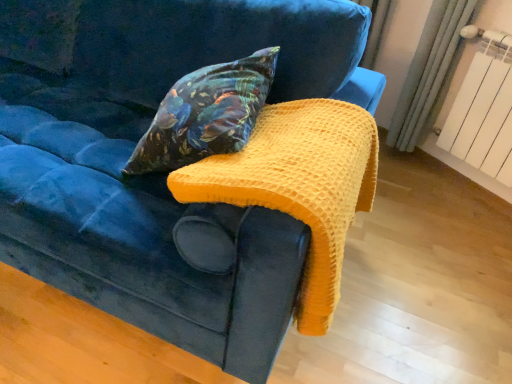
In the scene shown: Measure the distance between velvet floral pillow at center and camera.

velvet floral pillow at center and camera are 38.06 inches apart from each other.

Locate an element on the screen. The height and width of the screenshot is (384, 512). white painted metal radiator at upper right is located at coordinates (482, 105).

The width and height of the screenshot is (512, 384). I want to click on yellow waffle knit blanket at upper center, so click(x=298, y=185).

This screenshot has width=512, height=384. Find the location of `velvet floral pillow at center`. velvet floral pillow at center is located at coordinates (206, 114).

Does yellow waffle knit blanket at upper center have a lesser width compared to white painted metal radiator at upper right?

Incorrect, the width of yellow waffle knit blanket at upper center is not less than that of white painted metal radiator at upper right.

Based on the photo, which is closer to the camera, (x=312, y=220) or (x=498, y=101)?

Point (x=312, y=220) is positioned closer to the camera compared to point (x=498, y=101).

Find the location of a particular element. The height and width of the screenshot is (384, 512). blanket below the white painted metal radiator at upper right (from the image's perspective) is located at coordinates (298, 185).

Considering the relative sizes of yellow waffle knit blanket at upper center and white painted metal radiator at upper right in the image provided, is yellow waffle knit blanket at upper center bigger than white painted metal radiator at upper right?

Yes.

Find the location of a particular element. This screenshot has width=512, height=384. pillow to the left of yellow waffle knit blanket at upper center is located at coordinates (206, 114).

Could you tell me if velvet floral pillow at center is turned towards yellow waffle knit blanket at upper center?

No.

Is point (145, 137) closer or farther from the camera than point (327, 205)?

Clearly, point (145, 137) is more distant from the camera than point (327, 205).

Considering their positions, is velvet floral pillow at center located in front of or behind yellow waffle knit blanket at upper center?

velvet floral pillow at center is positioned farther from the viewer than yellow waffle knit blanket at upper center.

Is white painted metal radiator at upper right next to yellow waffle knit blanket at upper center?

No.

You are a GUI agent. You are given a task and a screenshot of the screen. Output one action in this format:
    pyautogui.click(x=<x>, y=<y>)
    Task: Click on the blanket in front of the white painted metal radiator at upper right
    
    Given the screenshot: What is the action you would take?
    pyautogui.click(x=298, y=185)

Can yellow waffle knit blanket at upper center be found inside white painted metal radiator at upper right?

No, yellow waffle knit blanket at upper center is not surrounded by white painted metal radiator at upper right.

From the image's perspective, is white painted metal radiator at upper right below yellow waffle knit blanket at upper center?

Incorrect, from the image's perspective, white painted metal radiator at upper right is higher than yellow waffle knit blanket at upper center.

Is velvet floral pillow at center aimed at white painted metal radiator at upper right?

No, velvet floral pillow at center is not aimed at white painted metal radiator at upper right.

Is point (198, 132) positioned before point (498, 91)?

Yes, point (198, 132) is closer to viewer.

This screenshot has width=512, height=384. What are the coordinates of `radiator on the right of velvet floral pillow at center` in the screenshot? It's located at (482, 105).

Based on the photo, is velvet floral pillow at center shorter than white painted metal radiator at upper right?

Indeed, velvet floral pillow at center has a lesser height compared to white painted metal radiator at upper right.

From the image's perspective, between white painted metal radiator at upper right and velvet floral pillow at center, who is located below?

velvet floral pillow at center, from the image's perspective.

Does white painted metal radiator at upper right turn towards velvet floral pillow at center?

Yes, white painted metal radiator at upper right faces towards velvet floral pillow at center.

How distant is white painted metal radiator at upper right from velvet floral pillow at center?

white painted metal radiator at upper right and velvet floral pillow at center are 4.39 feet apart from each other.

Looking at their sizes, would you say white painted metal radiator at upper right is wider or thinner than velvet floral pillow at center?

Considering their sizes, white painted metal radiator at upper right looks slimmer than velvet floral pillow at center.

Is yellow waffle knit blanket at upper center not close to velvet floral pillow at center?

yellow waffle knit blanket at upper center is near velvet floral pillow at center, not far away.

Considering the sizes of objects yellow waffle knit blanket at upper center and velvet floral pillow at center in the image provided, who is thinner, yellow waffle knit blanket at upper center or velvet floral pillow at center?

velvet floral pillow at center.

Locate an element on the screen. The image size is (512, 384). blanket in front of the velvet floral pillow at center is located at coordinates (298, 185).

Find the location of a particular element. blanket on the left side of white painted metal radiator at upper right is located at coordinates (298, 185).

This screenshot has width=512, height=384. In order to click on blanket to the right of velvet floral pillow at center in this screenshot , I will do `click(298, 185)`.

Based on their spatial positions, is yellow waffle knit blanket at upper center or white painted metal radiator at upper right further from velvet floral pillow at center?

white painted metal radiator at upper right is positioned further to the anchor velvet floral pillow at center.

Looking at the image, which one is located closer to yellow waffle knit blanket at upper center, velvet floral pillow at center or white painted metal radiator at upper right?

Among the two, velvet floral pillow at center is located nearer to yellow waffle knit blanket at upper center.

Looking at the image, which one is located closer to yellow waffle knit blanket at upper center, white painted metal radiator at upper right or velvet floral pillow at center?

velvet floral pillow at center.

When comparing their distances from white painted metal radiator at upper right, does velvet floral pillow at center or yellow waffle knit blanket at upper center seem closer?

yellow waffle knit blanket at upper center is closer to white painted metal radiator at upper right.

Based on their spatial positions, is yellow waffle knit blanket at upper center or velvet floral pillow at center further from white painted metal radiator at upper right?

velvet floral pillow at center.

Based on their spatial positions, is white painted metal radiator at upper right or yellow waffle knit blanket at upper center closer to velvet floral pillow at center?

Among the two, yellow waffle knit blanket at upper center is located nearer to velvet floral pillow at center.

Identify the location of blanket situated between velvet floral pillow at center and white painted metal radiator at upper right from left to right. Image resolution: width=512 pixels, height=384 pixels. click(x=298, y=185).